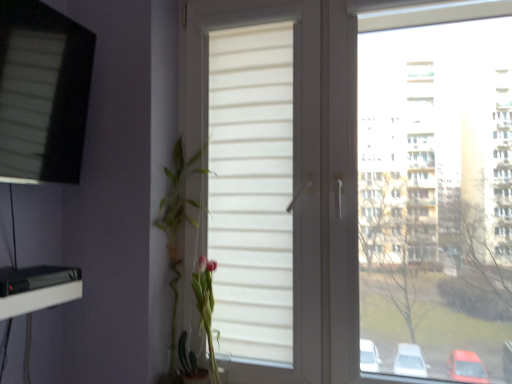
Describe the element at coordinates (357, 186) in the screenshot. The height and width of the screenshot is (384, 512). I see `white matte window at center, the first window when ordered from right to left` at that location.

Where is `matte black screen at upper left, the first window from the left`? This screenshot has height=384, width=512. matte black screen at upper left, the first window from the left is located at coordinates (42, 92).

From a real-world perspective, between green leafy plant at left and white matte window at center, the first window when ordered from right to left, who is vertically higher?

white matte window at center, the first window when ordered from right to left, from a real-world perspective.

Does green leafy plant at left contain white matte window at center, which is the 2th window in left-to-right order?

No, green leafy plant at left does not contain white matte window at center, which is the 2th window in left-to-right order.

From a real-world perspective, starting from the green leafy plant at left, which window is the 1st one vertically above it? Please provide its 2D coordinates.

[(357, 186)]

Is green leafy plant at left at the left side of white matte window at center, the first window when ordered from right to left?

Correct, you'll find green leafy plant at left to the left of white matte window at center, the first window when ordered from right to left.

Which object is positioned more to the left, green leafy plant at left or matte black screen at upper left, which appears as the 2th window when viewed from the right?

matte black screen at upper left, which appears as the 2th window when viewed from the right, is more to the left.

Which object is thinner, green leafy plant at left or matte black screen at upper left, which appears as the 2th window when viewed from the right?

Thinner between the two is matte black screen at upper left, which appears as the 2th window when viewed from the right.

Which object is further away from the camera taking this photo, green leafy plant at left or matte black screen at upper left, the first window from the left?

green leafy plant at left is behind.

Which is in front, point (250, 336) or point (179, 186)?

The point (250, 336) is closer to the camera.

Between white matte window at center, the first window when ordered from right to left, and green leafy plant at left, which one has larger width?

With larger width is green leafy plant at left.

This screenshot has height=384, width=512. In order to click on floral arrangement beneath the white matte window at center, the first window when ordered from right to left (from a real-world perspective) in this screenshot , I will do `click(177, 221)`.

Is green leafy plant at left located within white matte window at center, which is the 2th window in left-to-right order?

Indeed, green leafy plant at left is located within white matte window at center, which is the 2th window in left-to-right order.

Looking at the image, does white matte window at center, the first window when ordered from right to left, seem bigger or smaller compared to matte black screen at upper left, the first window from the left?

Considering their sizes, white matte window at center, the first window when ordered from right to left, takes up more space than matte black screen at upper left, the first window from the left.

Identify the location of window in front of the matte black screen at upper left, the first window from the left. This screenshot has height=384, width=512. (357, 186).

From the image's perspective, is white matte window at center, the first window when ordered from right to left, on matte black screen at upper left, which appears as the 2th window when viewed from the right?

No, from the image's perspective, white matte window at center, the first window when ordered from right to left, is not on top of matte black screen at upper left, which appears as the 2th window when viewed from the right.

Is matte black screen at upper left, which appears as the 2th window when viewed from the right, bigger or smaller than white matte window at center, which is the 2th window in left-to-right order?

In the image, matte black screen at upper left, which appears as the 2th window when viewed from the right, appears to be smaller than white matte window at center, which is the 2th window in left-to-right order.

The image size is (512, 384). I want to click on window in front of the matte black screen at upper left, the first window from the left, so click(357, 186).

Can you tell me how much matte black screen at upper left, the first window from the left, and white matte window at center, the first window when ordered from right to left, differ in facing direction?

matte black screen at upper left, the first window from the left, and white matte window at center, the first window when ordered from right to left, are facing 92.3 degrees away from each other.

Is matte black screen at upper left, the first window from the left, not near white matte window at center, the first window when ordered from right to left?

No, matte black screen at upper left, the first window from the left, is in close proximity to white matte window at center, the first window when ordered from right to left.

Looking at the image, does matte black screen at upper left, which appears as the 2th window when viewed from the right, seem bigger or smaller compared to green leafy plant at left?

Clearly, matte black screen at upper left, which appears as the 2th window when viewed from the right, is larger in size than green leafy plant at left.

Does matte black screen at upper left, which appears as the 2th window when viewed from the right, appear on the right side of green leafy plant at left?

In fact, matte black screen at upper left, which appears as the 2th window when viewed from the right, is to the left of green leafy plant at left.

Would you say matte black screen at upper left, the first window from the left, contains green leafy plant at left?

No.

The height and width of the screenshot is (384, 512). I want to click on window that is the 1st one when counting upward from the green leafy plant at left (from the image's perspective), so click(x=357, y=186).

In the image, there is a matte black screen at upper left, which appears as the 2th window when viewed from the right. Where is `floral arrangement below it (from the image's perspective)`? The image size is (512, 384). floral arrangement below it (from the image's perspective) is located at coordinates (177, 221).

When comparing their distances from green leafy plant at left, does white matte window at center, the first window when ordered from right to left, or matte black screen at upper left, which appears as the 2th window when viewed from the right, seem further?

matte black screen at upper left, which appears as the 2th window when viewed from the right, lies further to green leafy plant at left than the other object.

Considering their positions, is white matte window at center, which is the 2th window in left-to-right order, positioned closer to matte black screen at upper left, which appears as the 2th window when viewed from the right, than green leafy plant at left?

The object closer to matte black screen at upper left, which appears as the 2th window when viewed from the right, is green leafy plant at left.

Estimate the real-world distances between objects in this image. Which object is further from matte black screen at upper left, the first window from the left, green leafy plant at left or white matte window at center, which is the 2th window in left-to-right order?

white matte window at center, which is the 2th window in left-to-right order.

Based on their spatial positions, is matte black screen at upper left, the first window from the left, or white matte window at center, the first window when ordered from right to left, closer to green leafy plant at left?

Based on the image, white matte window at center, the first window when ordered from right to left, appears to be nearer to green leafy plant at left.

From the image, which object appears to be farther from white matte window at center, the first window when ordered from right to left, green leafy plant at left or matte black screen at upper left, which appears as the 2th window when viewed from the right?

Based on the image, matte black screen at upper left, which appears as the 2th window when viewed from the right, appears to be further to white matte window at center, the first window when ordered from right to left.

Based on their spatial positions, is matte black screen at upper left, the first window from the left, or green leafy plant at left further from white matte window at center, which is the 2th window in left-to-right order?

matte black screen at upper left, the first window from the left, is positioned further to the anchor white matte window at center, which is the 2th window in left-to-right order.

Find the location of a particular element. The height and width of the screenshot is (384, 512). floral arrangement located between matte black screen at upper left, the first window from the left, and white matte window at center, which is the 2th window in left-to-right order, in the left-right direction is located at coordinates (177, 221).